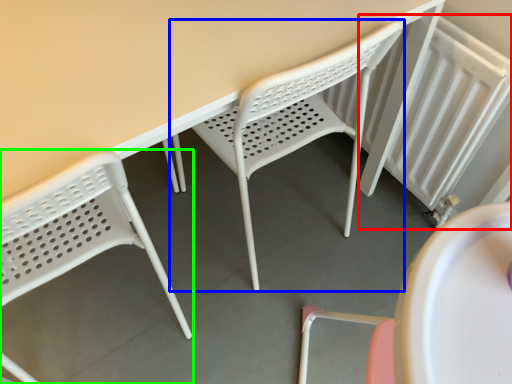
Question: Based on their relative distances, which object is nearer to radiator (highlighted by a red box)? Choose from chair (highlighted by a blue box) and chair (highlighted by a green box).

Choices:
 (A) chair
 (B) chair

Answer: (A)